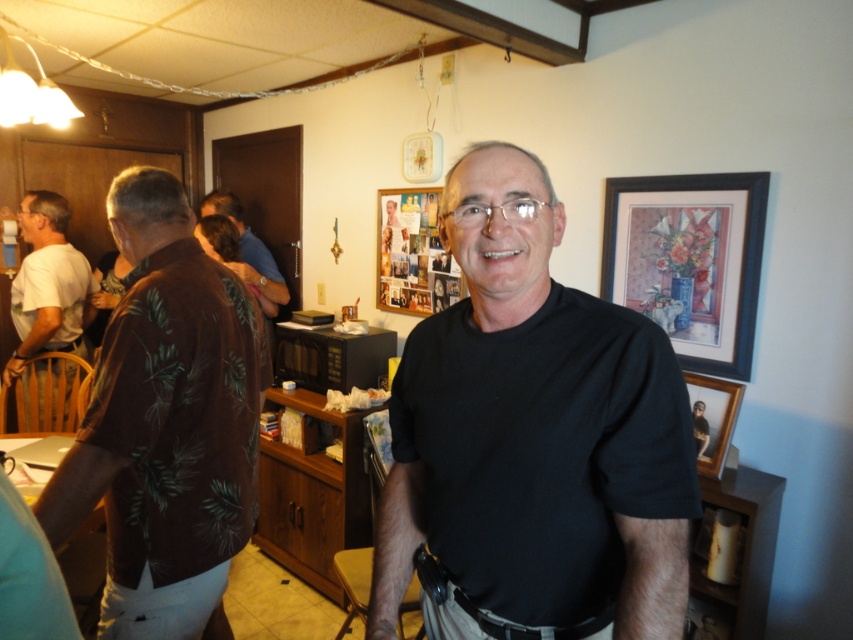
What do you see at coordinates (413, 253) in the screenshot? I see `wooden picture frame at upper center` at bounding box center [413, 253].

In order to click on wooden picture frame at upper center in this screenshot , I will do `click(413, 253)`.

At what (x,y) coordinates should I click in order to perform the action: click on wooden picture frame at upper center. Please return your answer as a coordinate pair (x, y). The image size is (853, 640). Looking at the image, I should click on (413, 253).

Is black matte shirt at center smaller than brown floral shirt at left?

Indeed, black matte shirt at center has a smaller size compared to brown floral shirt at left.

Does black matte shirt at center have a larger size compared to brown floral shirt at left?

Actually, black matte shirt at center might be smaller than brown floral shirt at left.

The image size is (853, 640). Find the location of `black matte shirt at center`. black matte shirt at center is located at coordinates (532, 438).

Is point (268, 268) positioned in front of point (699, 449)?

No, it is not.

Is brown floral shirt at center bigger than wooden picture frame at center?

Yes, brown floral shirt at center is bigger than wooden picture frame at center.

Identify the location of brown floral shirt at center. (247, 252).